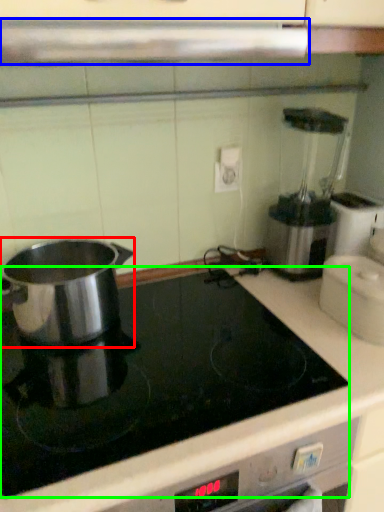
Question: Which is nearer to the kitchen appliance (highlighted by a red box)? exhaust hood (highlighted by a blue box) or kitchen appliance (highlighted by a green box).

Choices:
 (A) exhaust hood
 (B) kitchen appliance

Answer: (B)